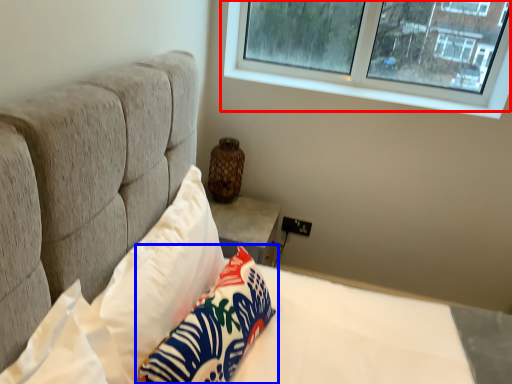
Question: Which point is further to the camera, window (highlighted by a red box) or pillow (highlighted by a blue box)?

Choices:
 (A) window
 (B) pillow

Answer: (A)